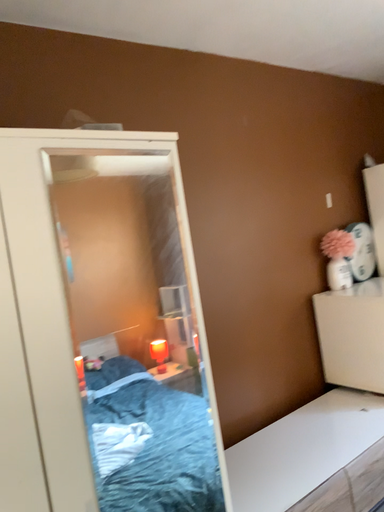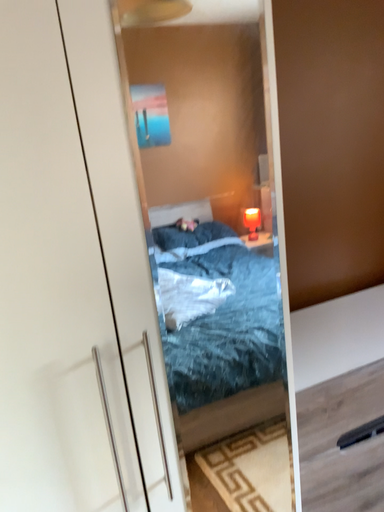
Question: How did the camera likely rotate when shooting the video?

Choices:
 (A) rotated downward
 (B) rotated upward

Answer: (A)